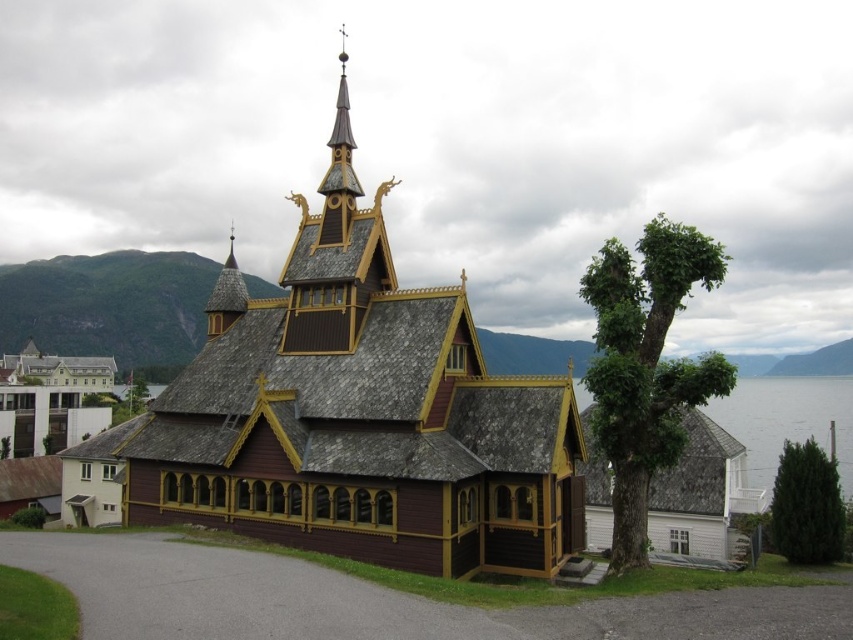
Question: Considering the real-world distances, which object is farthest from the transparent water at lower right?

Choices:
 (A) brown wooden church at lower left
 (B) brown wooden chapel at center

Answer: (A)

Question: Which point is farther to the camera?

Choices:
 (A) (843, 428)
 (B) (335, 436)

Answer: (A)

Question: Which of the following is the closest to the observer?

Choices:
 (A) green leafy tree at lower right
 (B) transparent water at lower right
 (C) green leafy tree at right

Answer: (C)

Question: Can you confirm if brown wooden church at lower left is smaller than transparent water at lower right?

Choices:
 (A) yes
 (B) no

Answer: (A)

Question: Does transparent water at lower right lie behind green leafy tree at lower right?

Choices:
 (A) yes
 (B) no

Answer: (B)

Question: Is green leafy tree at right thinner than brown wooden church at lower left?

Choices:
 (A) no
 (B) yes

Answer: (A)